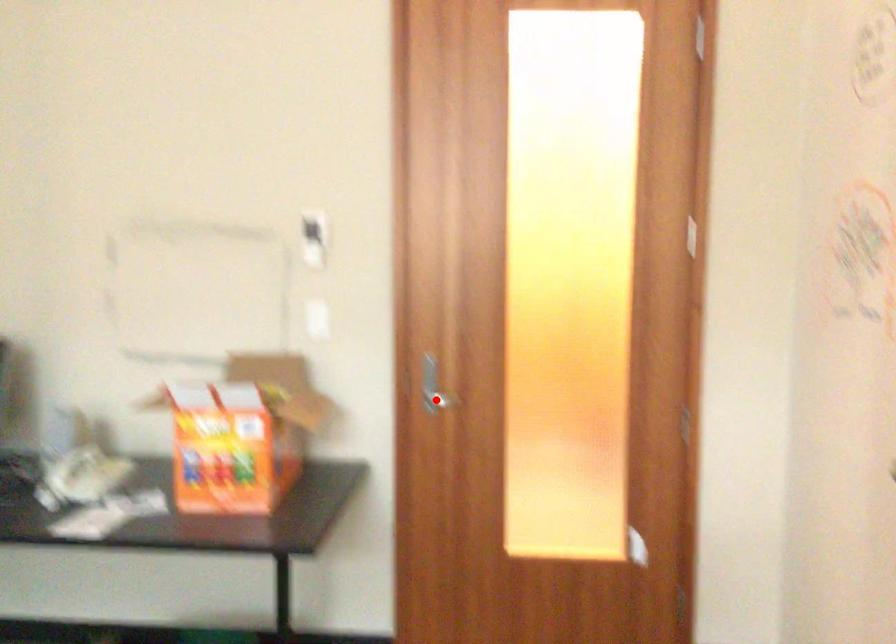
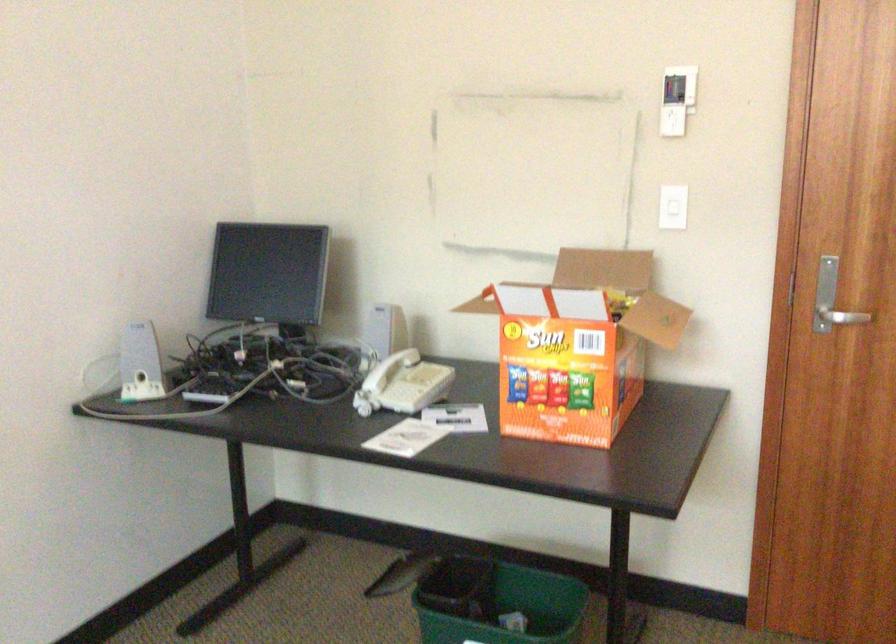
Where in the second image is the point corresponding to the highlighted location from the first image?

(842, 317)